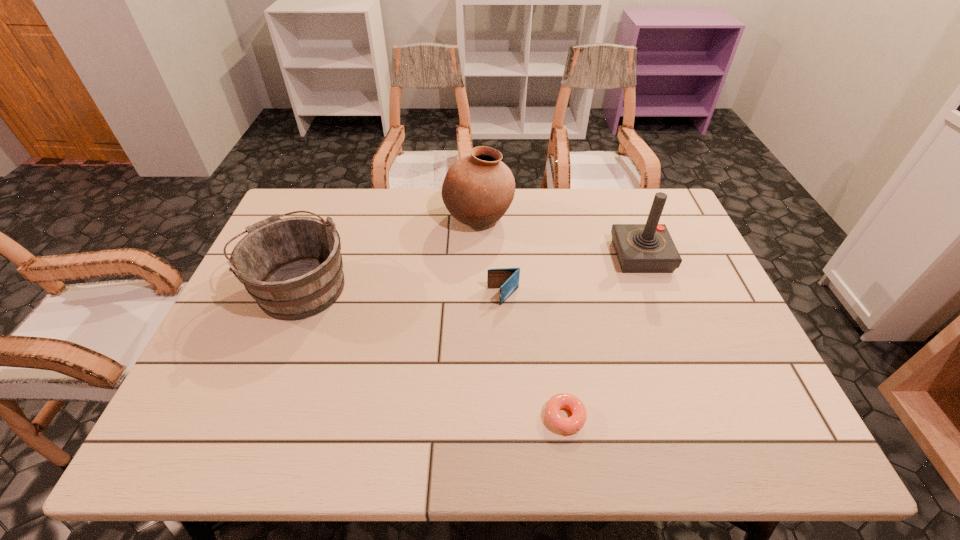
Locate an element on the screen. vacant space at the far edge of the desktop is located at coordinates (529, 206).

Image resolution: width=960 pixels, height=540 pixels. In order to click on vacant region at the near edge of the desktop in this screenshot , I will do click(641, 436).

This screenshot has width=960, height=540. Find the location of `free space at the left edge of the desktop`. free space at the left edge of the desktop is located at coordinates (246, 313).

In the image, there is a desktop. Identify the location of vacant area at the right edge. (671, 278).

The height and width of the screenshot is (540, 960). What are the coordinates of `free location at the far left corner of the desktop` in the screenshot? It's located at (291, 201).

I want to click on free space at the near left corner of the desktop, so click(185, 443).

In the image, there is a desktop. Identify the location of free space at the near right corner. This screenshot has width=960, height=540. (748, 441).

Find the location of a particular element. This screenshot has width=960, height=540. free space between the nearest object and the wallet is located at coordinates (534, 357).

Find the location of a particular element. The height and width of the screenshot is (540, 960). free space between the doughnut and the pottery is located at coordinates (521, 318).

Locate an element on the screen. The height and width of the screenshot is (540, 960). empty space between the rightmost object and the third shortest object is located at coordinates (469, 271).